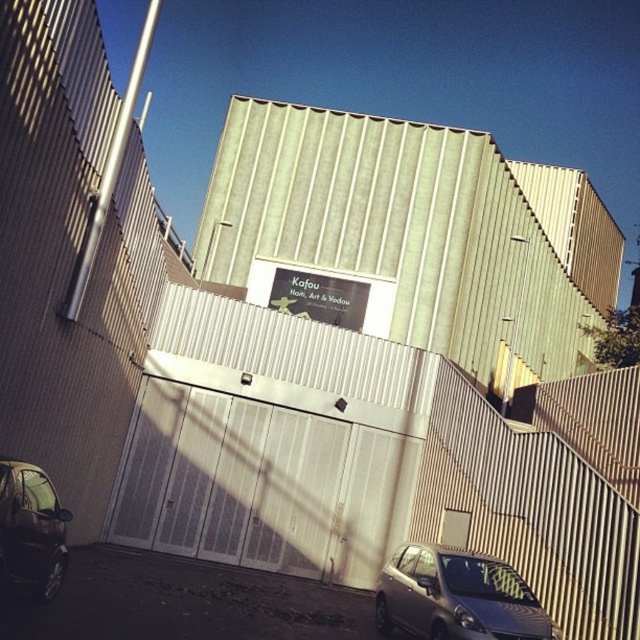
You are a visitor at the modern architectural structure shown. You notice a point marked at coordinates (456, 596). Which object is this point located on?

The point marked at coordinates (456, 596) is located on the satin silver hatchback at lower right.

You are a visitor arriving at the modern architectural structure. You see a satin silver hatchback at lower right and a shiny silver car at lower left. Which vehicle is bigger in size?

The satin silver hatchback at lower right is larger in size compared to the shiny silver car at lower left.